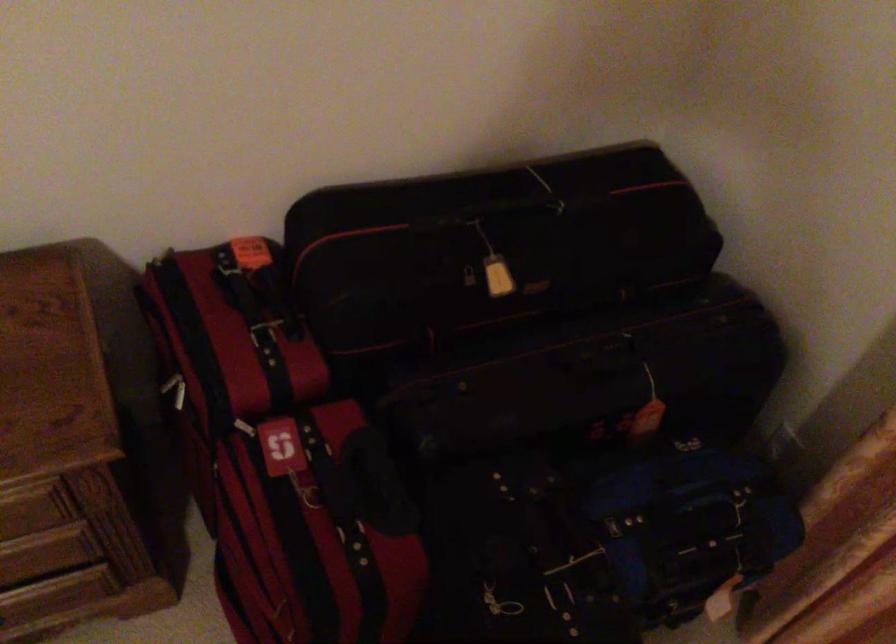
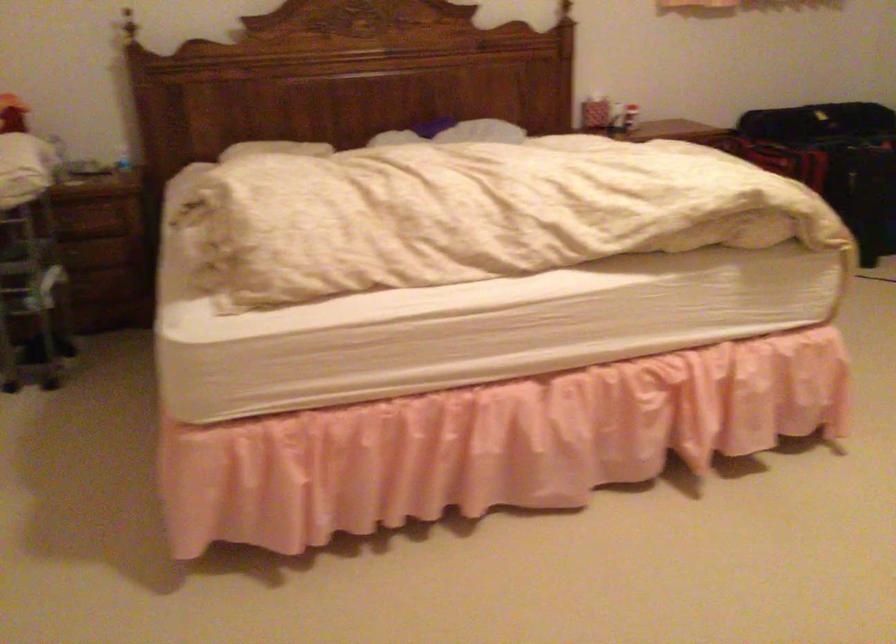
In a continuous first-person perspective shot, in which direction is the camera moving?

The cameraman moved toward left, backward.